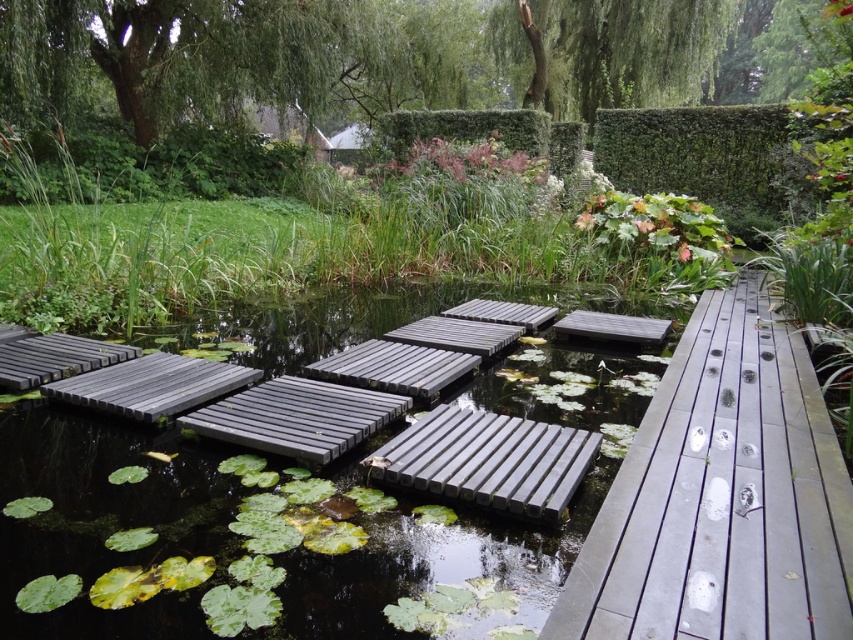
Question: Can you confirm if matte black wooden planks at center is positioned to the right of charcoal gray wood floating bridge at lower left?

Choices:
 (A) no
 (B) yes

Answer: (B)

Question: Does green leafy tree at upper left come behind charcoal gray wood floating bridge at lower left?

Choices:
 (A) no
 (B) yes

Answer: (B)

Question: Which object is farther from the camera taking this photo?

Choices:
 (A) smooth gray wooden planks at center
 (B) smooth gray plank at center
 (C) green leafy tree at upper left
 (D) wooden park bench at center

Answer: (C)

Question: Estimate the real-world distances between objects in this image. Which object is farther from the wooden park bench at center?

Choices:
 (A) green leafy tree at upper center
 (B) charcoal gray wood floating bridge at lower left

Answer: (A)

Question: Which point is closer to the camera?

Choices:
 (A) (16, 445)
 (B) (39, 369)
 (C) (405, 369)

Answer: (A)

Question: Can you confirm if smooth gray plank at center is positioned to the left of wooden park bench at center?

Choices:
 (A) no
 (B) yes

Answer: (B)